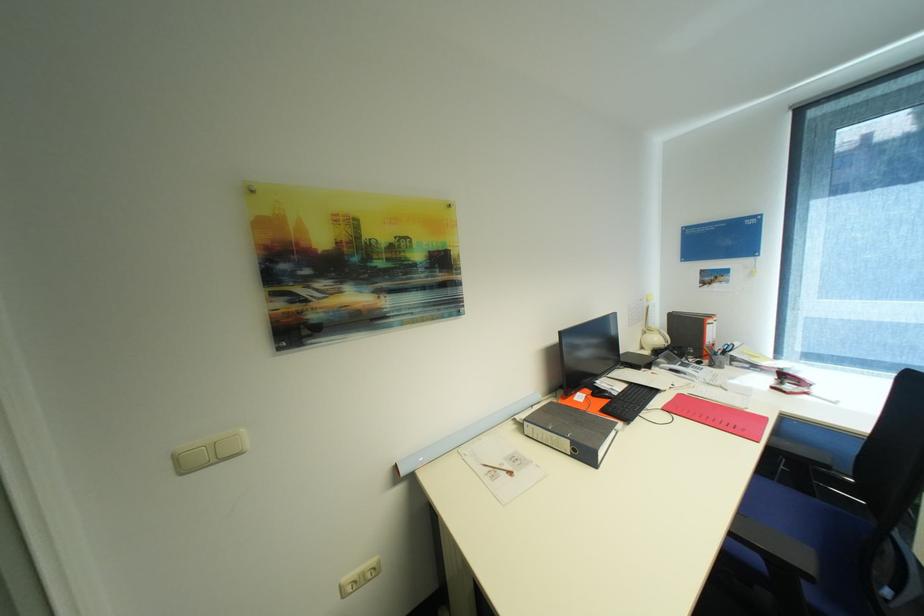
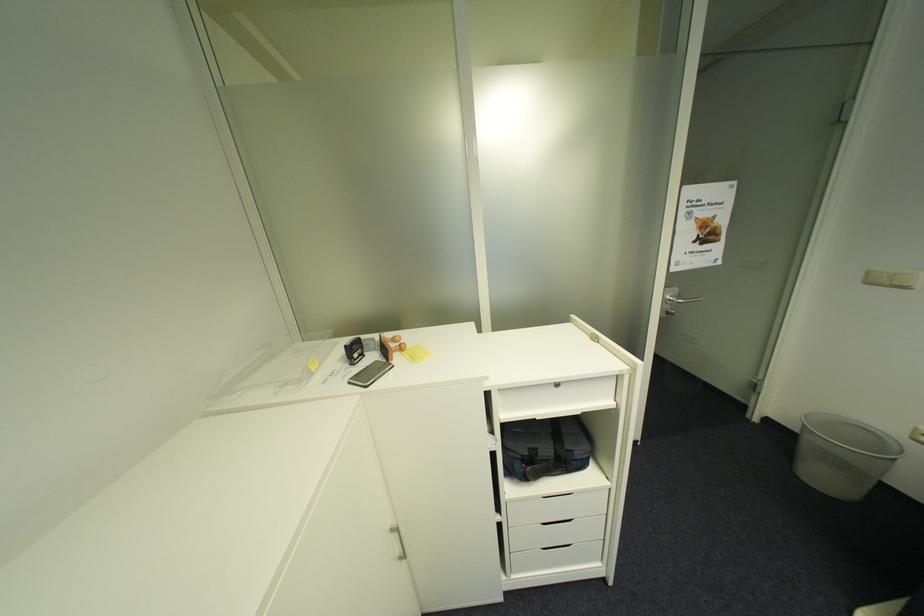
Locate, in the second image, the point that corresponds to pixel 222 461 in the first image.

(895, 285)